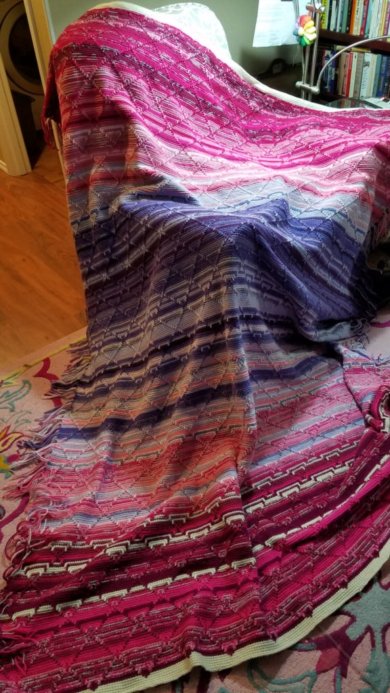
Find the location of a particular element. The height and width of the screenshot is (693, 390). light is located at coordinates (238, 179).